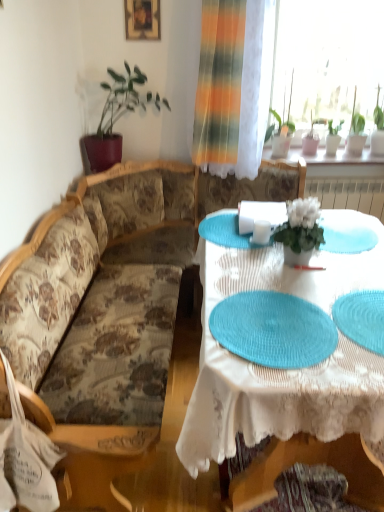
The height and width of the screenshot is (512, 384). In order to click on free spot behind blue woven placemat at lower right in this screenshot , I will do `click(341, 271)`.